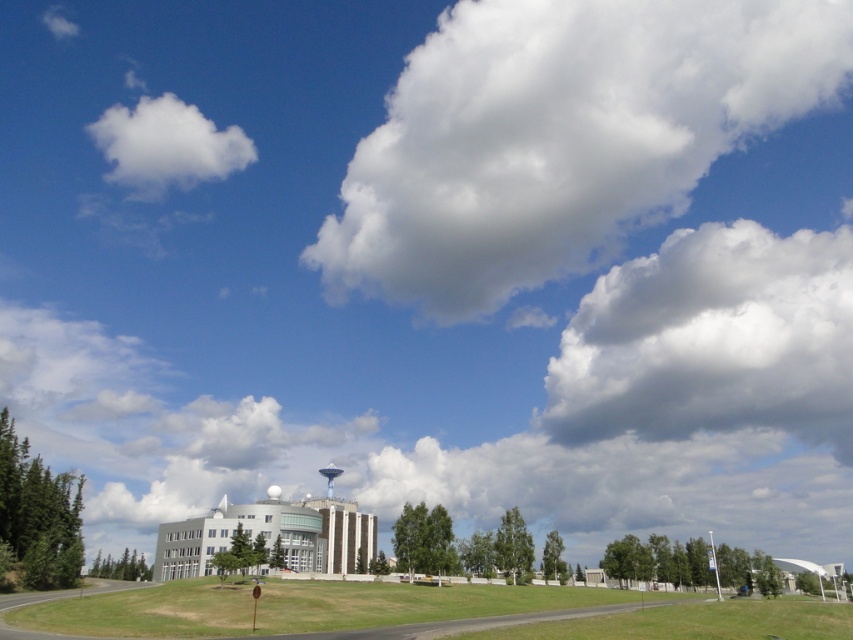
Looking at the sky in the scene, where is the white fluffy cloud at upper right positioned relative to the white fluffy cloud at upper left?

The white fluffy cloud at upper right is positioned to the right of the white fluffy cloud at upper left.